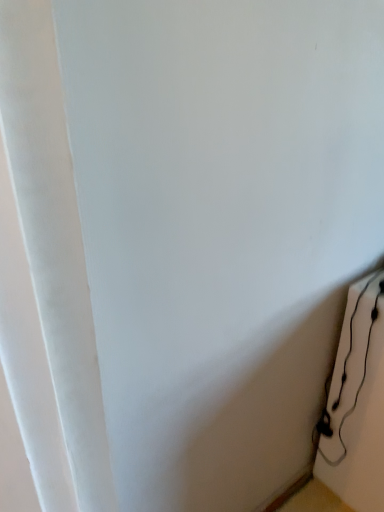
Locate an element on the screen. black rubber wire at lower right is located at coordinates (361, 380).

Measure the distance between black rubber wire at lower right and camera.

They are 1.10 meters apart.

Image resolution: width=384 pixels, height=512 pixels. What do you see at coordinates (361, 380) in the screenshot?
I see `black rubber wire at lower right` at bounding box center [361, 380].

Where is `black rubber wire at lower right`? This screenshot has width=384, height=512. black rubber wire at lower right is located at coordinates (361, 380).